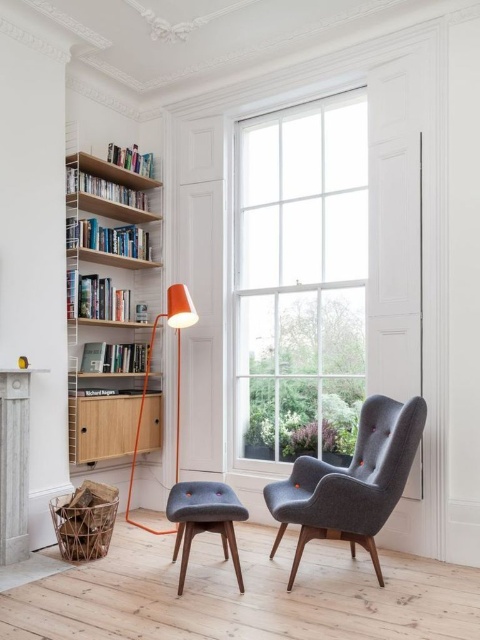
You are organizing a small party and need to place a 1.2 meter long tablecloth. You see the wooden bookshelf at left and the light brown wood cabinet at left. Which object can accommodate the tablecloth without folding it?

The wooden bookshelf at left has a larger size compared to light brown wood cabinet at left, so it can accommodate the 1.2 meter long tablecloth without folding it.

You are standing in the room and want to look outside through the clear glass window at center. According to the coordinates provided, where should you look to see the outside view?

You should look at the coordinates point (x=300, y=280) to see the outside view through the clear glass window at center.